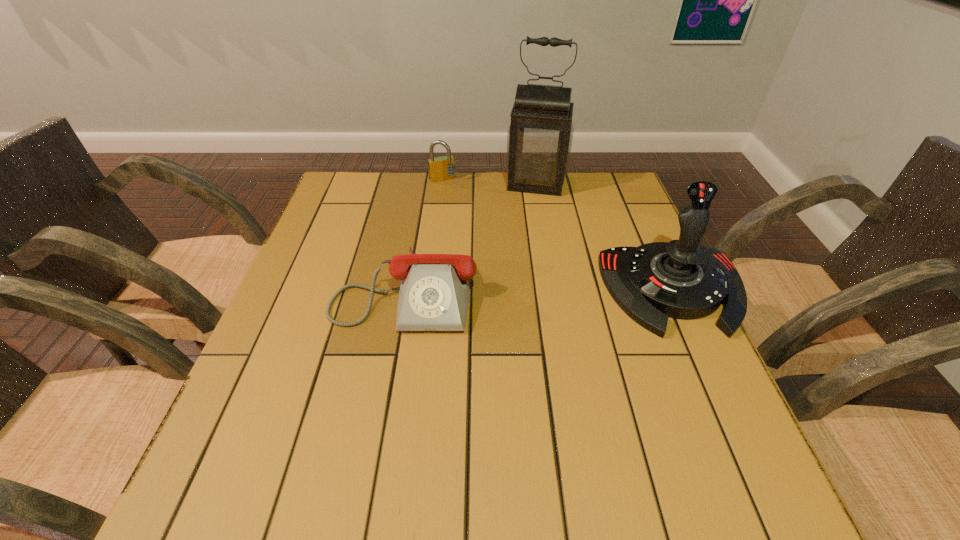
The height and width of the screenshot is (540, 960). Find the location of `telephone`. telephone is located at coordinates (434, 293).

I want to click on the rightmost object, so click(683, 279).

At what (x,y) coordinates should I click in order to perform the action: click on joystick. Please return your answer as a coordinate pair (x, y). Looking at the image, I should click on [x=683, y=279].

Image resolution: width=960 pixels, height=540 pixels. What are the coordinates of `the tallest object` in the screenshot? It's located at (539, 138).

I want to click on lantern, so click(539, 138).

You are a GUI agent. You are given a task and a screenshot of the screen. Output one action in this format:
    pyautogui.click(x=<x>, y=<y>)
    Task: Click on the second shortest object
    Image resolution: width=960 pixels, height=540 pixels.
    Given the screenshot: What is the action you would take?
    pyautogui.click(x=442, y=168)

Locate an element on the screen. The width and height of the screenshot is (960, 540). blank space located on the dial of the shortest object is located at coordinates (387, 394).

Where is `free region located on the handle side of the rightmost object`? The image size is (960, 540). free region located on the handle side of the rightmost object is located at coordinates (730, 413).

Find the location of a particular element. Image resolution: width=960 pixels, height=540 pixels. free space located 0.120m on the front-facing side of the third object from left to right is located at coordinates (528, 220).

Identify the location of free space located on the front-facing side of the third object from left to right. 524,238.